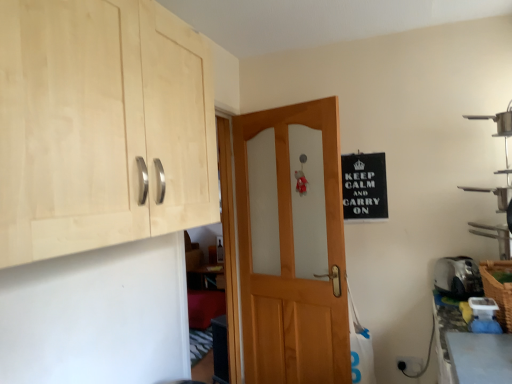
Question: Is black paper sign at upper right oriented away from natural wood cabinet at upper left?

Choices:
 (A) no
 (B) yes

Answer: (A)

Question: Is the depth of black paper sign at upper right greater than that of natural wood cabinet at upper left?

Choices:
 (A) no
 (B) yes

Answer: (B)

Question: Is black paper sign at upper right completely or partially outside of natural wood cabinet at upper left?

Choices:
 (A) no
 (B) yes

Answer: (B)

Question: Is black paper sign at upper right wider than natural wood cabinet at upper left?

Choices:
 (A) no
 (B) yes

Answer: (A)

Question: From a real-world perspective, is black paper sign at upper right below natural wood cabinet at upper left?

Choices:
 (A) no
 (B) yes

Answer: (B)

Question: From the image's perspective, is metallic silver shelf at right positioned above or below wooden door at center?

Choices:
 (A) below
 (B) above

Answer: (B)

Question: From a real-world perspective, is metallic silver shelf at right physically located above or below wooden door at center?

Choices:
 (A) below
 (B) above

Answer: (B)

Question: Looking at the image, does metallic silver shelf at right seem bigger or smaller compared to wooden door at center?

Choices:
 (A) big
 (B) small

Answer: (B)

Question: Looking at their shapes, would you say metallic silver shelf at right is wider or thinner than wooden door at center?

Choices:
 (A) wide
 (B) thin

Answer: (A)

Question: From their relative heights in the image, would you say natural wood cabinet at upper left is taller or shorter than silver metallic toaster at lower right?

Choices:
 (A) tall
 (B) short

Answer: (A)

Question: Would you say natural wood cabinet at upper left is to the left or to the right of silver metallic toaster at lower right in the picture?

Choices:
 (A) right
 (B) left

Answer: (B)

Question: Based on their sizes in the image, would you say natural wood cabinet at upper left is bigger or smaller than silver metallic toaster at lower right?

Choices:
 (A) small
 (B) big

Answer: (B)

Question: From the image's perspective, relative to silver metallic toaster at lower right, is natural wood cabinet at upper left above or below?

Choices:
 (A) below
 (B) above

Answer: (B)

Question: From a real-world perspective, relative to black paper sign at upper right, is metallic silver shelf at right vertically above or below?

Choices:
 (A) above
 (B) below

Answer: (B)

Question: Based on their sizes in the image, would you say metallic silver shelf at right is bigger or smaller than black paper sign at upper right?

Choices:
 (A) small
 (B) big

Answer: (B)